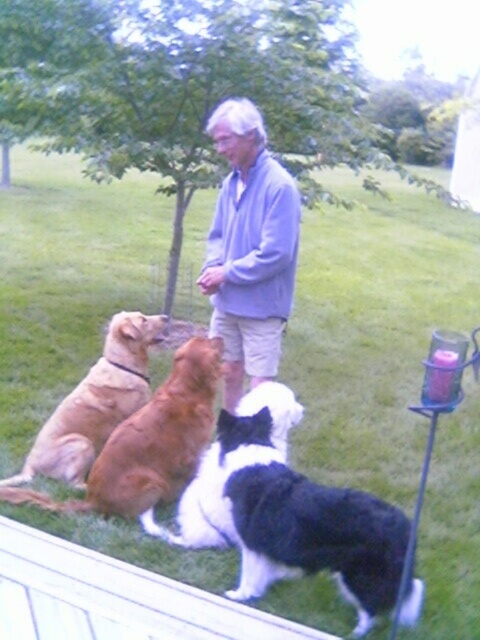
Question: Considering the relative positions of light blue sweater at center and golden brown fur at center in the image provided, where is light blue sweater at center located with respect to golden brown fur at center?

Choices:
 (A) above
 (B) below

Answer: (A)

Question: Does light blue sweater at center appear on the left side of golden brown fur at center?

Choices:
 (A) no
 (B) yes

Answer: (A)

Question: Which object appears farthest from the camera in this image?

Choices:
 (A) light blue sweater at center
 (B) golden brown fur at center

Answer: (B)

Question: Considering the real-world distances, which object is farthest from the golden brown fur at center?

Choices:
 (A) black and white fur at center
 (B) light blue sweater at center

Answer: (A)

Question: Can you confirm if black and white fur at center is thinner than golden brown fur at center?

Choices:
 (A) yes
 (B) no

Answer: (B)

Question: Which point appears closest to the camera in this image?

Choices:
 (A) (405, 614)
 (B) (84, 426)
 (C) (278, 332)

Answer: (A)